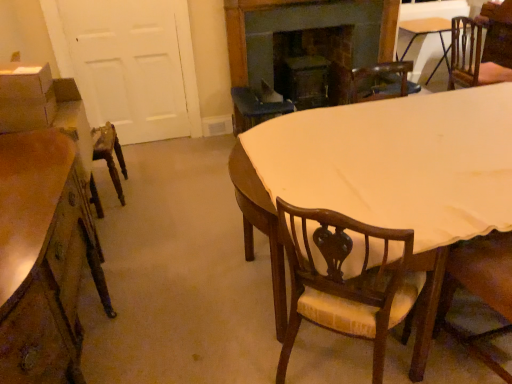
Find the location of a particular element. The width and height of the screenshot is (512, 384). vacant space situated on the left part of wooden chair with upholstered seat at center, which appears as the 3th chair when viewed from the top is located at coordinates (238, 350).